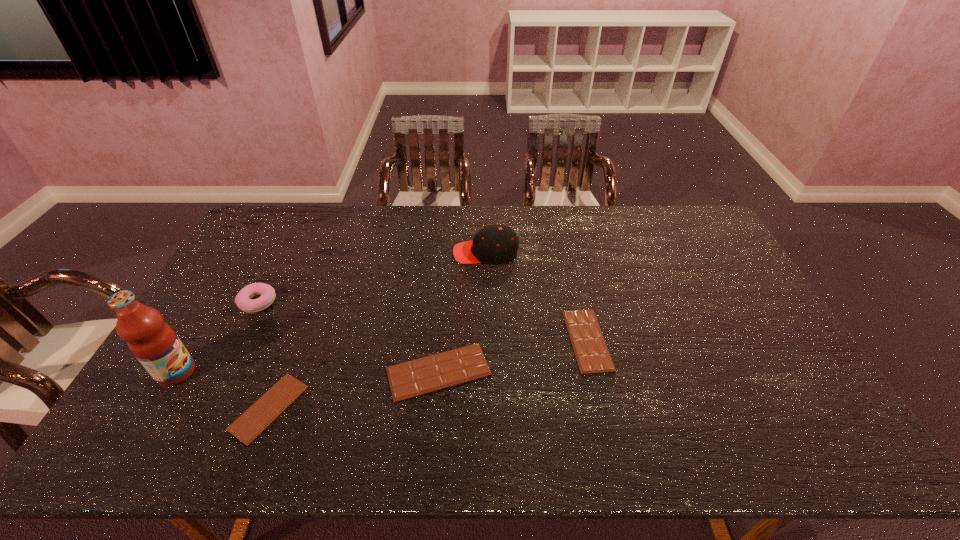
Identify the location of pastry. (243, 300).

The width and height of the screenshot is (960, 540). Identify the location of vacant space located on the back of the shortest object. (312, 296).

Locate an element on the screen. vacant area situated 0.230m on the left of the second chocolate bar from right to left is located at coordinates (300, 372).

Identify the location of blank space located 0.270m on the right of the rightmost object. This screenshot has width=960, height=540. (703, 340).

Identify the location of free space located on the front-facing side of the cap. The height and width of the screenshot is (540, 960). (398, 253).

Locate an element on the screen. The width and height of the screenshot is (960, 540). free spot located 0.320m on the front-facing side of the cap is located at coordinates (361, 253).

Locate an element on the screen. This screenshot has width=960, height=540. vacant position located 0.150m on the front-facing side of the cap is located at coordinates (410, 253).

Where is `vacant space situated 0.240m on the front label of the leftmost object`? vacant space situated 0.240m on the front label of the leftmost object is located at coordinates (285, 373).

Where is `blank space located 0.320m on the right of the second object from left to right`? blank space located 0.320m on the right of the second object from left to right is located at coordinates [379, 302].

Where is `object that is positioned at the far edge`? The image size is (960, 540). object that is positioned at the far edge is located at coordinates (493, 244).